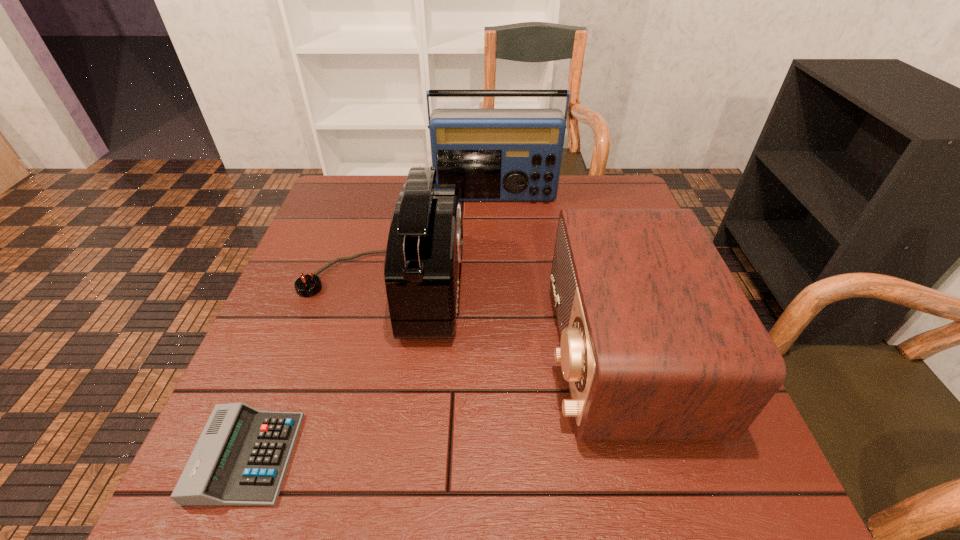
Where is `free space at the far left corner of the desktop`? The height and width of the screenshot is (540, 960). free space at the far left corner of the desktop is located at coordinates (335, 195).

Locate an element on the screen. vacant space at the near right corner is located at coordinates (745, 497).

The height and width of the screenshot is (540, 960). In order to click on blank region between the calculator and the second shortest object in this screenshot , I will do `click(433, 405)`.

The height and width of the screenshot is (540, 960). Find the location of `empty space between the shortest object and the second shortest object`. empty space between the shortest object and the second shortest object is located at coordinates (433, 405).

The width and height of the screenshot is (960, 540). I want to click on vacant region between the shortest object and the shortest radio receiver, so click(x=433, y=405).

Locate an element on the screen. The image size is (960, 540). free space that is in between the second tallest radio receiver and the second shortest object is located at coordinates (500, 319).

The image size is (960, 540). Find the location of `free space between the calculator and the shortest radio receiver`. free space between the calculator and the shortest radio receiver is located at coordinates pyautogui.click(x=433, y=405).

At what (x,y) coordinates should I click in order to perform the action: click on vacant area that lies between the shortest radio receiver and the shortest object. Please return your answer as a coordinate pair (x, y). This screenshot has height=540, width=960. Looking at the image, I should click on (433, 405).

Image resolution: width=960 pixels, height=540 pixels. In order to click on unoccupied position between the shortest radio receiver and the second shortest radio receiver in this screenshot , I will do `click(500, 319)`.

This screenshot has width=960, height=540. I want to click on free point between the calculator and the second tallest object, so click(x=314, y=372).